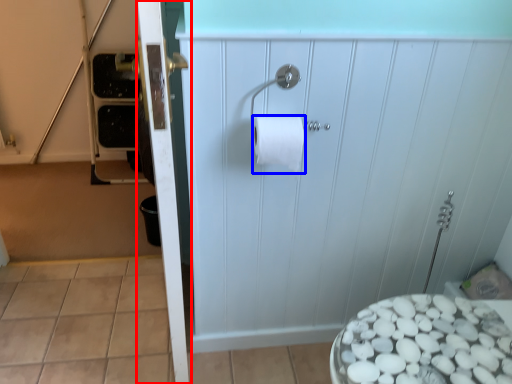
Question: Which object is closer to the camera taking this photo, screen door (highlighted by a red box) or toilet paper (highlighted by a blue box)?

Choices:
 (A) screen door
 (B) toilet paper

Answer: (A)